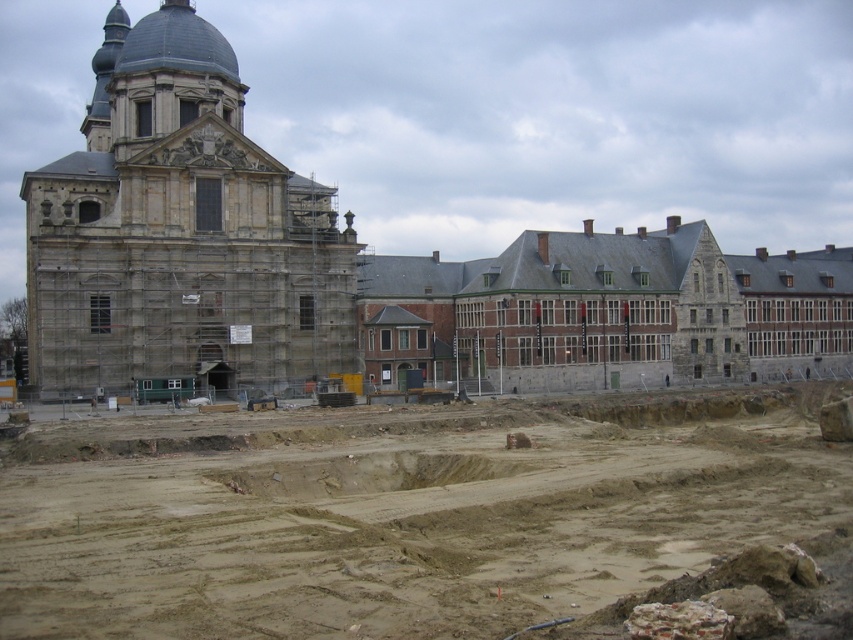
You are a construction worker standing at the center of the construction site. You see two points marked on the ground, point 1 at point (459, 500) and point 2 at point (321, 230). Which point is closer to you?

Point 1 at point (459, 500) is closer to you than point 2 at point (321, 230).

You are a construction worker who needs to transport materials from the brown sandy dirt field at lower center to the stone church at left. Which area has more space to store additional materials?

The stone church at left has more space to store additional materials because the brown sandy dirt field at lower center is smaller than the stone church at left.